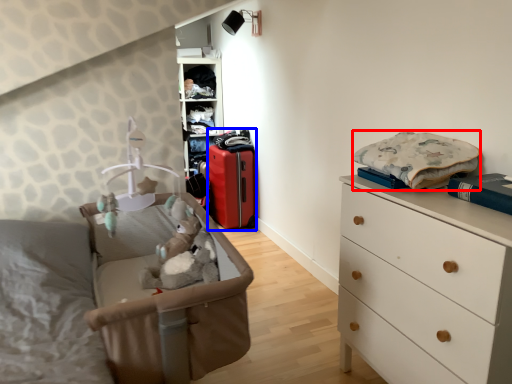
Question: Which point is further to the camera, clothing (highlighted by a red box) or luggage (highlighted by a blue box)?

Choices:
 (A) clothing
 (B) luggage

Answer: (B)